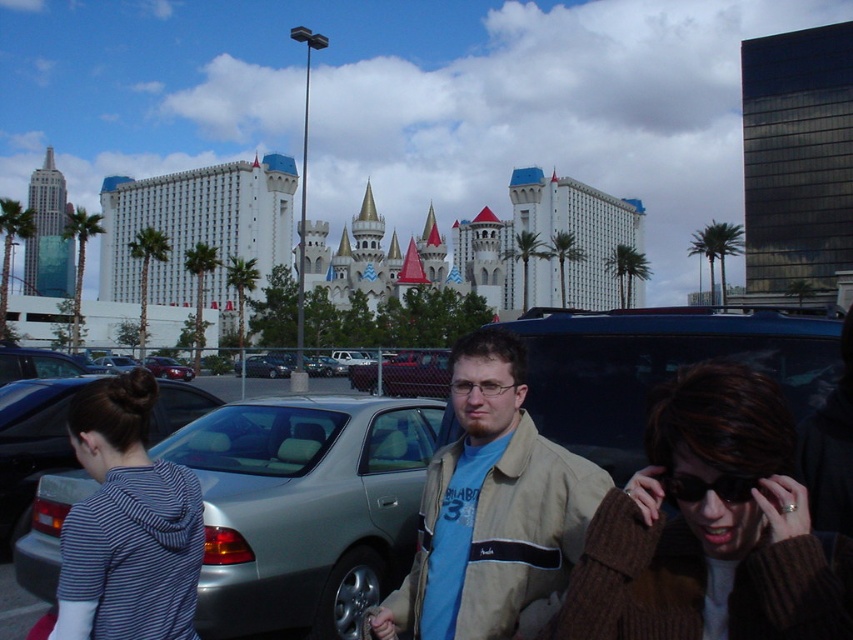
From the picture: Who is positioned more to the right, silver metallic car at center or brown knitted sweater at lower right?

brown knitted sweater at lower right

Who is more forward, (x=251, y=403) or (x=775, y=390)?

Point (x=775, y=390)

In order to click on silver metallic car at center in this screenshot , I will do `click(305, 508)`.

The image size is (853, 640). Describe the element at coordinates (492, 509) in the screenshot. I see `beige jacket at center` at that location.

Measure the distance between beige jacket at center and camera.

The distance of beige jacket at center from camera is 158.93 feet.

Where is `beige jacket at center`? This screenshot has width=853, height=640. beige jacket at center is located at coordinates (492, 509).

Looking at this image, does brown knitted sweater at lower right have a lesser height compared to shiny red sedan at center?

No.

Where is `brown knitted sweater at lower right`? The image size is (853, 640). brown knitted sweater at lower right is located at coordinates (711, 529).